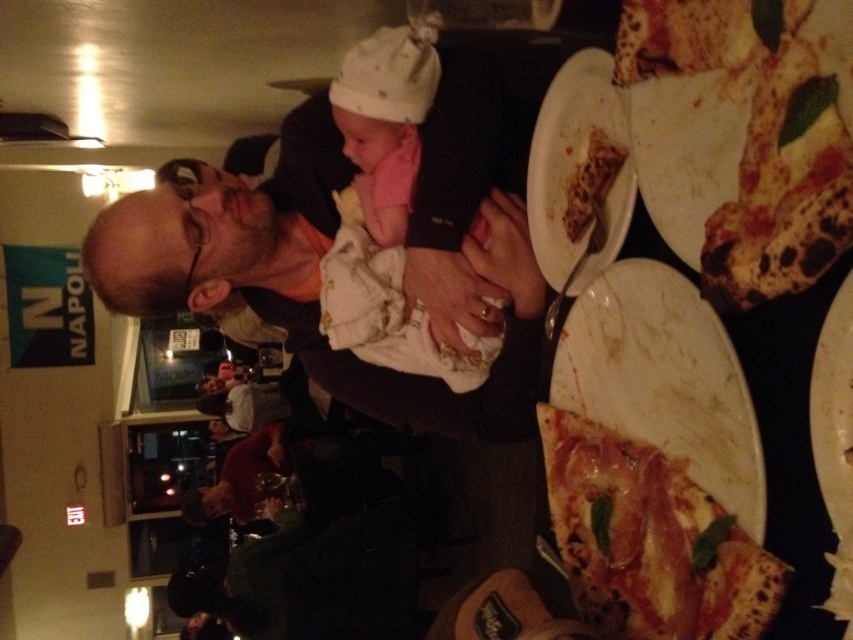
You are a photographer trying to capture a closeup of the golden brown crust at lower right without including the white matte plate at right in the frame. Given that the distance between them is 26.19 centimeters, and your camera has a focal length of 50mm, can you estimate if using a telephoto lens with a 85mm focal length would help you achieve this?

The golden brown crust at lower right is 26.19 centimeters away from the white matte plate at right. Using a telephoto lens with an 85mm focal length would narrow the field of view compared to a 50mm lens, making it easier to isolate the golden brown crust at lower right and exclude the white matte plate at right from the frame.

In the scene described, there is a matte black shirt at center and a white marble plate at upper right. From the perspective of someone standing in front of the scene, which object is positioned to the right?

The white marble plate at upper right is positioned to the right of the matte black shirt at center.

You are a photographer who wants to capture the golden brown crust at lower right and the white marble plate at lower right in a single shot. Since the camera can only focus on one object at a time, which object should you focus on to ensure the other remains in the background?

Answer: You should focus on the golden brown crust at lower right because it is positioned under the white marble plate at lower right, meaning the white marble plate is closer to the camera. Focusing on the crust will keep the plate in the background.